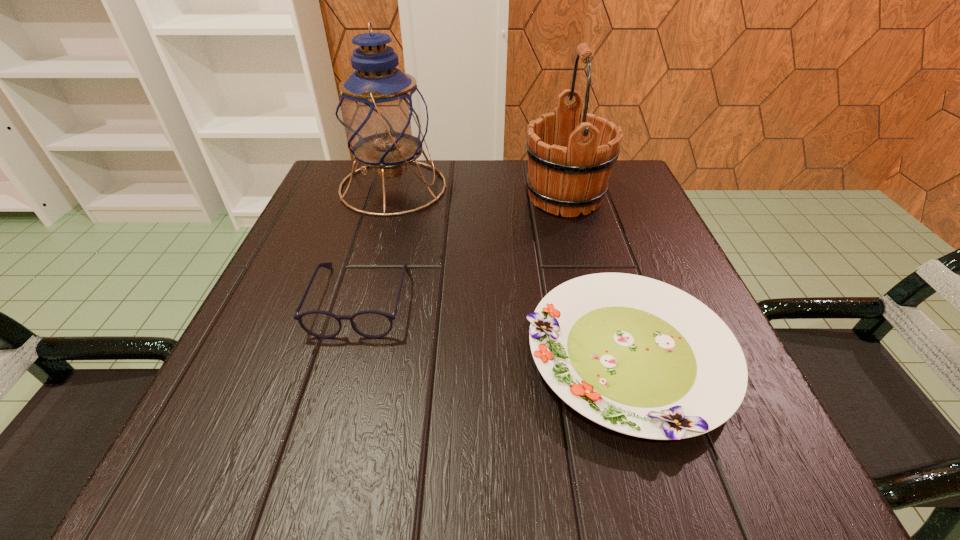
Find the location of a particular element. This screenshot has width=960, height=540. vacant space at the left edge of the desktop is located at coordinates (272, 346).

Locate an element on the screen. The width and height of the screenshot is (960, 540). free space at the right edge is located at coordinates (603, 260).

What are the coordinates of `vacant region at the far left corner` in the screenshot? It's located at click(x=353, y=213).

Where is `free region at the far right corner of the desktop`? This screenshot has height=540, width=960. free region at the far right corner of the desktop is located at coordinates (617, 160).

Where is `free space at the near right corner of the desktop`? This screenshot has height=540, width=960. free space at the near right corner of the desktop is located at coordinates (773, 456).

Find the location of a particular element. Image resolution: width=960 pixels, height=540 pixels. vacant area that lies between the lantern and the wine bucket is located at coordinates (479, 192).

What are the coordinates of `free space between the wine bucket and the lantern` in the screenshot? It's located at (479, 192).

Identify the location of unoccupied position between the salad plate and the lantern. The width and height of the screenshot is (960, 540). (511, 272).

At what (x,y) coordinates should I click in order to perform the action: click on vacant area between the lantern and the wine bucket. Please return your answer as a coordinate pair (x, y). Looking at the image, I should click on (479, 192).

What are the coordinates of `vacant region between the third tallest object and the wine bucket` in the screenshot? It's located at (463, 248).